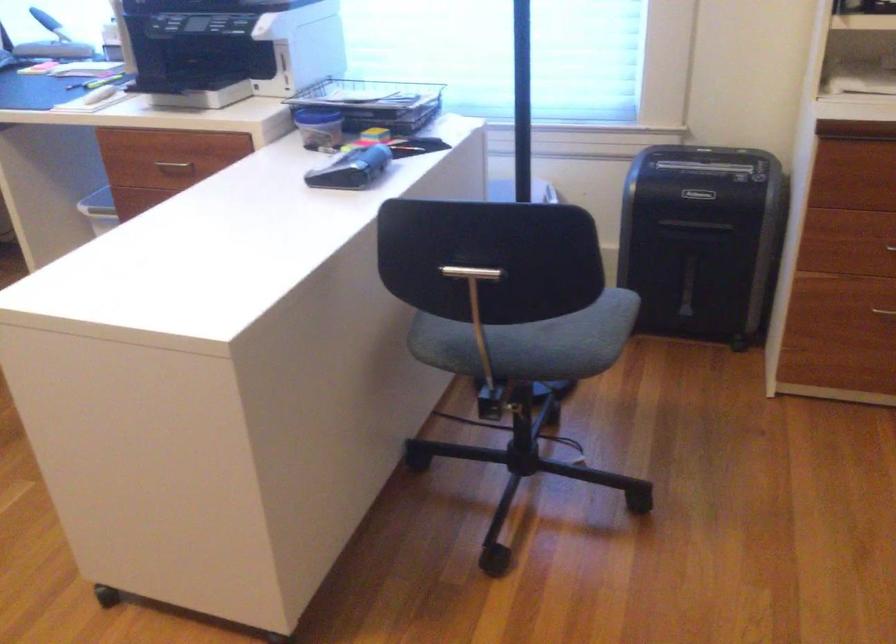
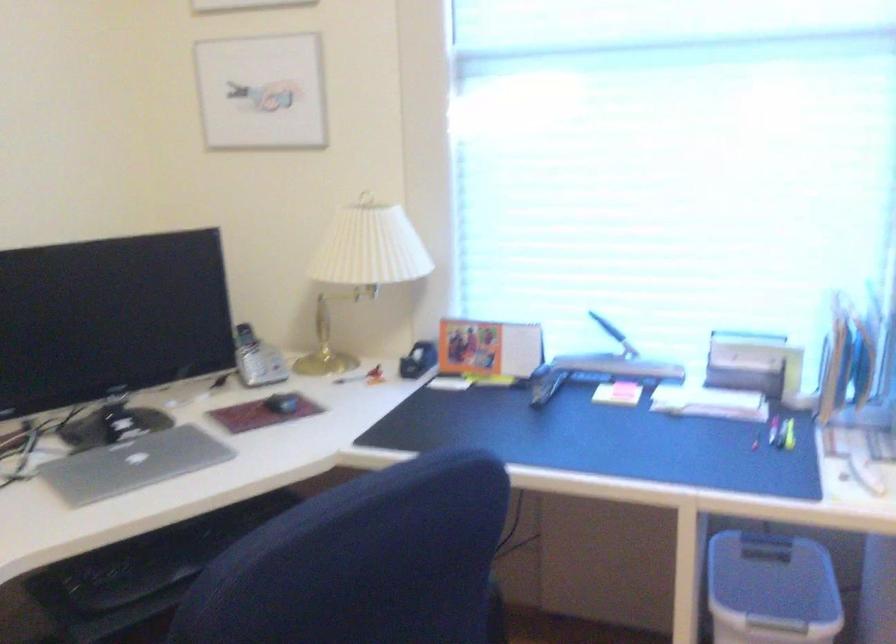
What movement of the cameraman would produce the second image?

The movement direction of the cameraman is left, forward.